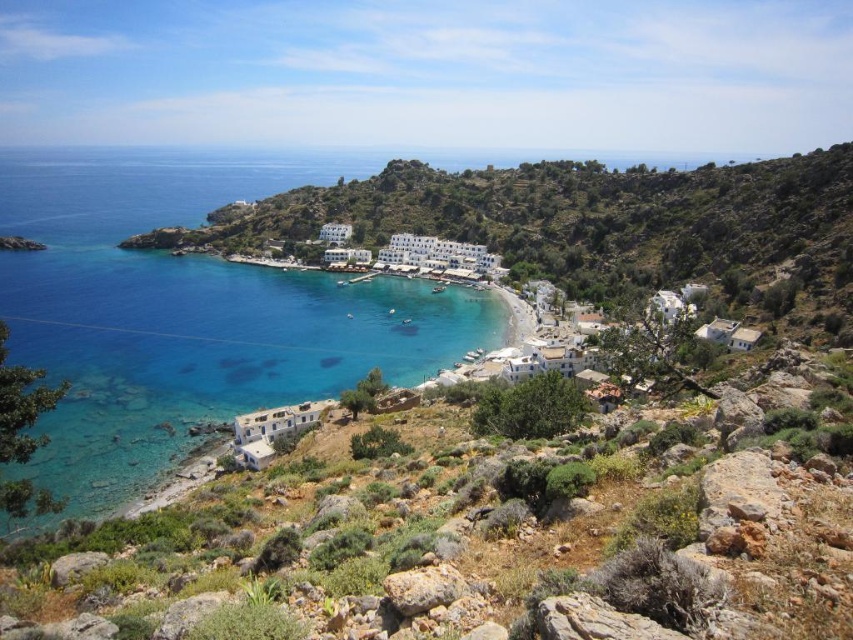
You are planning to take a photo of the coastal scene. You want to capture both the clear blue water at center and the white stone buildings at center in your shot. Based on their sizes in the image, which one will occupy more of the frame?

The clear blue water at center occupies more of the frame because its width is larger than that of the white stone buildings at center.

You are a photographer planning to capture the entire scene in one shot. Given that the clear blue water at center and the white stone buildings at center are both in the frame, which of these two objects appears taller in the image?

The clear blue water at center appears taller than the white stone buildings at center in the image.